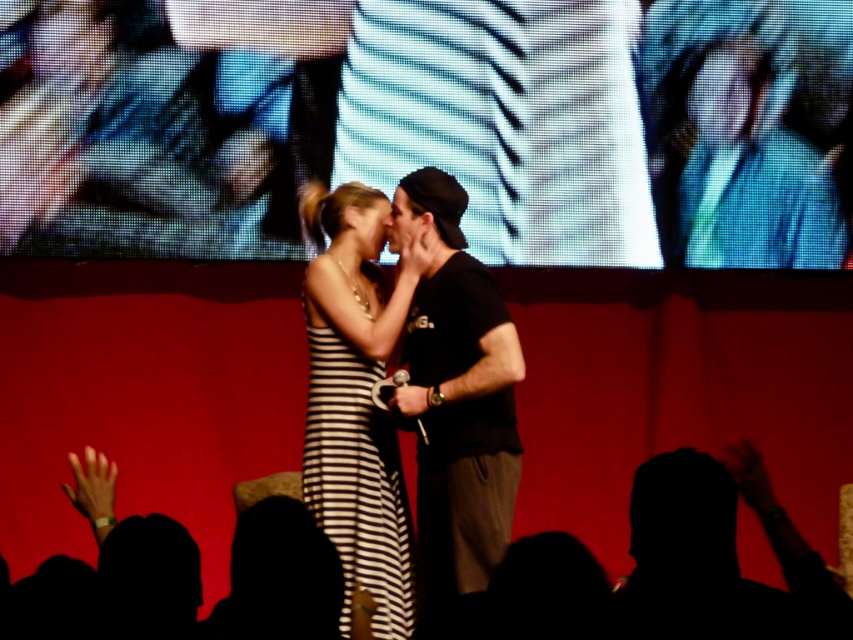
Question: Does black cotton t-shirt at center appear on the right side of matte black hair at center?

Choices:
 (A) no
 (B) yes

Answer: (B)

Question: Is black cotton t-shirt at center above black striped dress at center?

Choices:
 (A) no
 (B) yes

Answer: (B)

Question: Which object is closer to the camera taking this photo?

Choices:
 (A) black cotton t-shirt at center
 (B) matte black hair at center
 (C) matte black face at center

Answer: (A)

Question: Which object is farther from the camera taking this photo?

Choices:
 (A) black striped dress at center
 (B) black cotton t-shirt at center
 (C) matte black hair at center

Answer: (C)

Question: Can you confirm if black striped dress at center is positioned to the right of matte black hair at center?

Choices:
 (A) yes
 (B) no

Answer: (B)

Question: Which object is closer to the camera taking this photo?

Choices:
 (A) blue fabric at upper center
 (B) black striped dress at center
 (C) matte black face at center

Answer: (B)